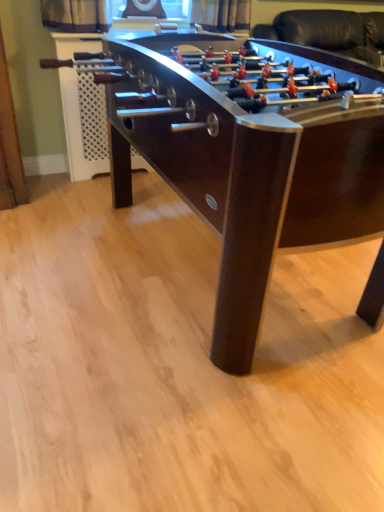
Describe the element at coordinates (250, 155) in the screenshot. The width and height of the screenshot is (384, 512). I see `dark wood foosball table at center` at that location.

Where is `dark wood foosball table at center`? This screenshot has width=384, height=512. dark wood foosball table at center is located at coordinates (250, 155).

Measure the distance between point (269, 272) and camera.

Point (269, 272) is 4.05 feet away from camera.

This screenshot has height=512, width=384. I want to click on dark wood foosball table at center, so pyautogui.click(x=250, y=155).